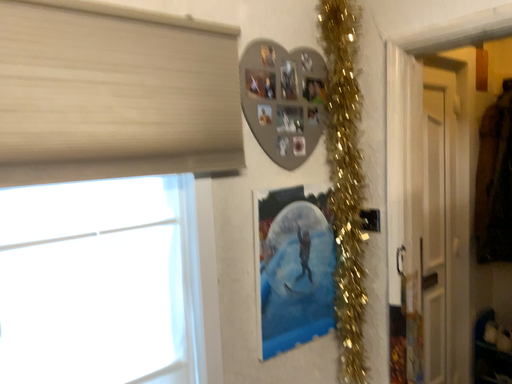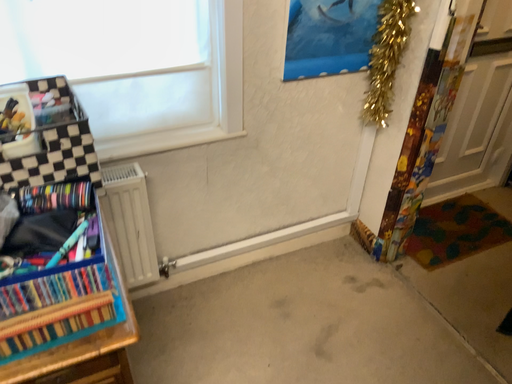
Question: How did the camera likely rotate when shooting the video?

Choices:
 (A) rotated left
 (B) rotated right

Answer: (A)